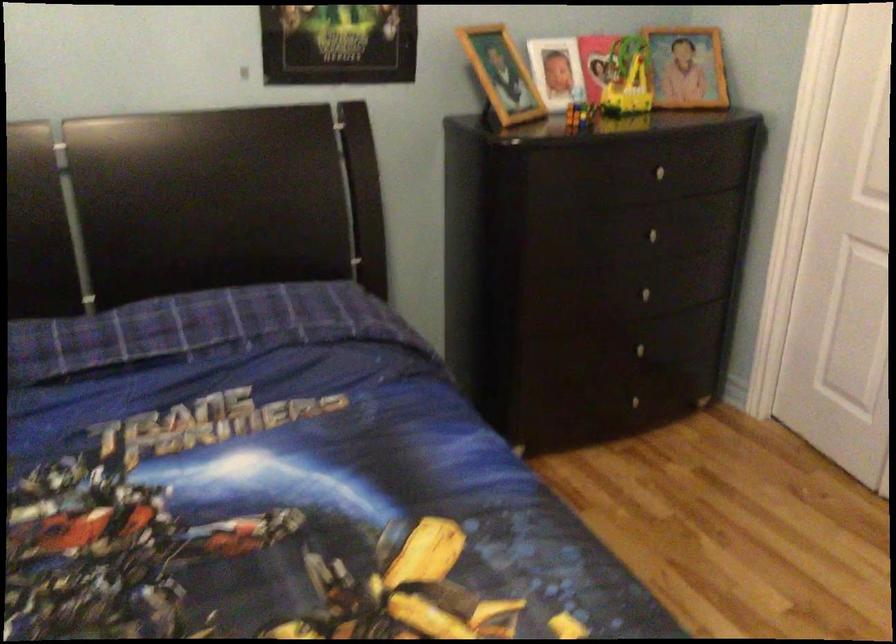
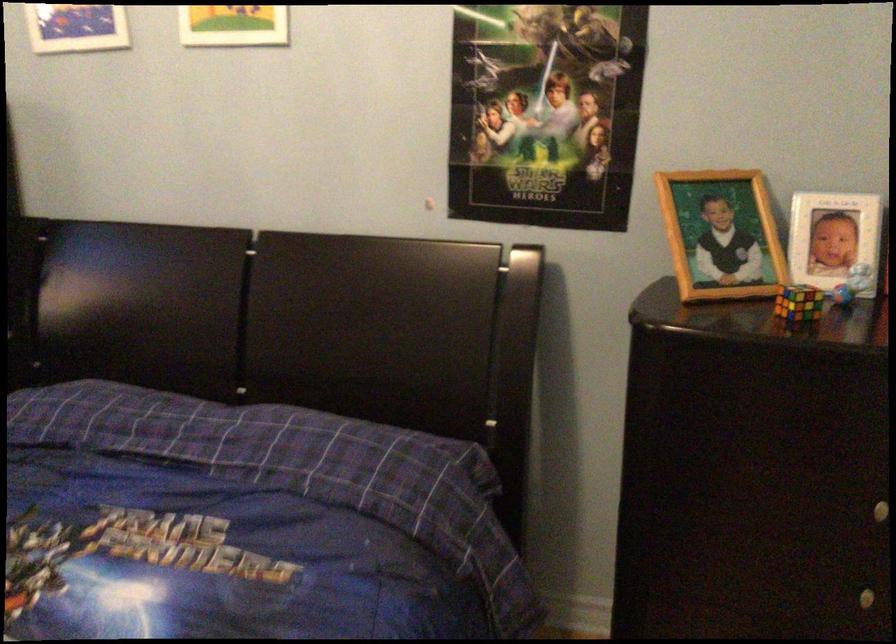
Locate, in the second image, the point that corresponds to (x=500, y=71) in the first image.

(720, 234)